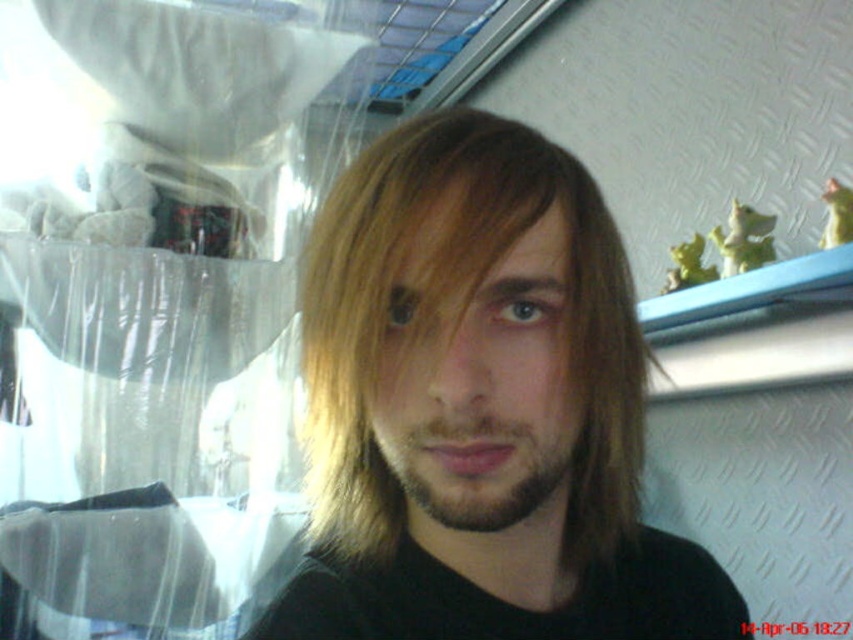
Question: Which object is closer to the camera taking this photo?

Choices:
 (A) blondehair at center
 (B) dark brown stubble at center

Answer: (A)

Question: Does blondehair at center appear on the right side of dark brown stubble at center?

Choices:
 (A) yes
 (B) no

Answer: (B)

Question: Which of the following is the closest to the observer?

Choices:
 (A) dark brown stubble at center
 (B) blondehair at center

Answer: (B)

Question: Among these points, which one is nearest to the camera?

Choices:
 (A) (456, 417)
 (B) (306, 362)

Answer: (A)

Question: Can you confirm if blondehair at center is smaller than dark brown stubble at center?

Choices:
 (A) yes
 (B) no

Answer: (B)

Question: Does blondehair at center have a lesser width compared to dark brown stubble at center?

Choices:
 (A) no
 (B) yes

Answer: (A)